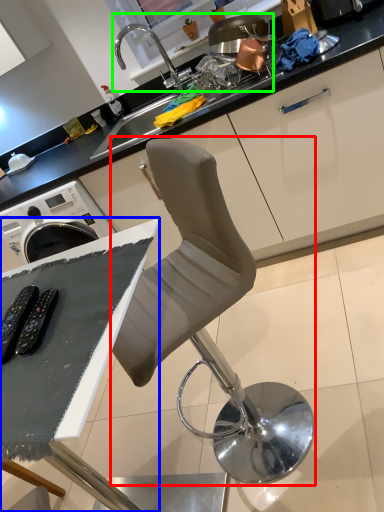
Question: Estimate the real-world distances between objects in this image. Which object is farther from chair (highlighted by a red box), table (highlighted by a blue box) or sink (highlighted by a green box)?

Choices:
 (A) table
 (B) sink

Answer: (B)